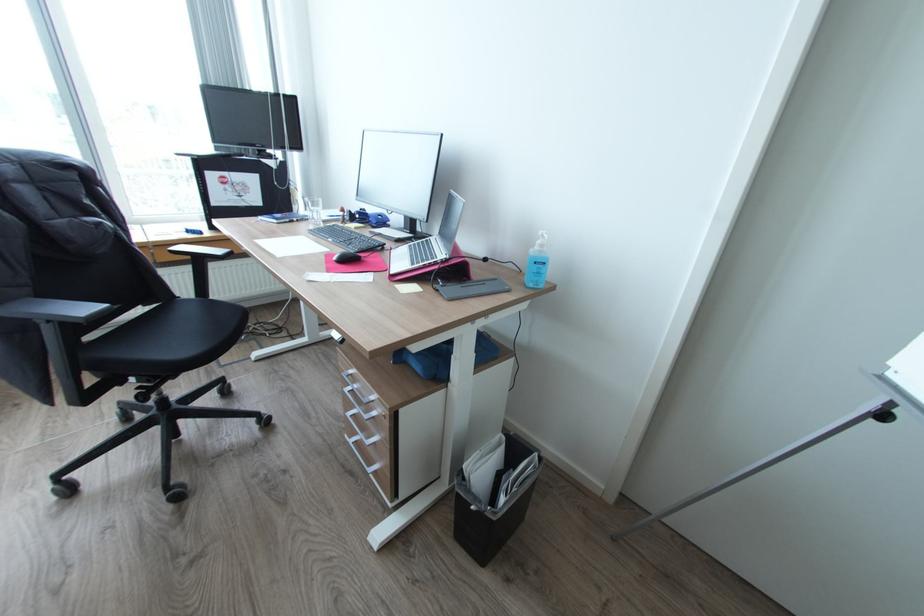
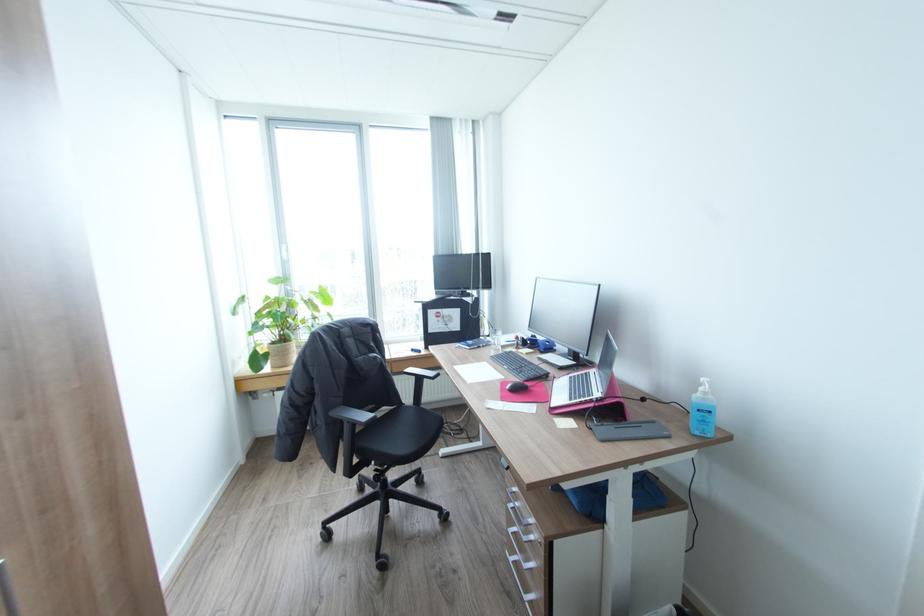
Locate, in the second image, the point that corresponds to (354,391) in the first image.

(517, 508)